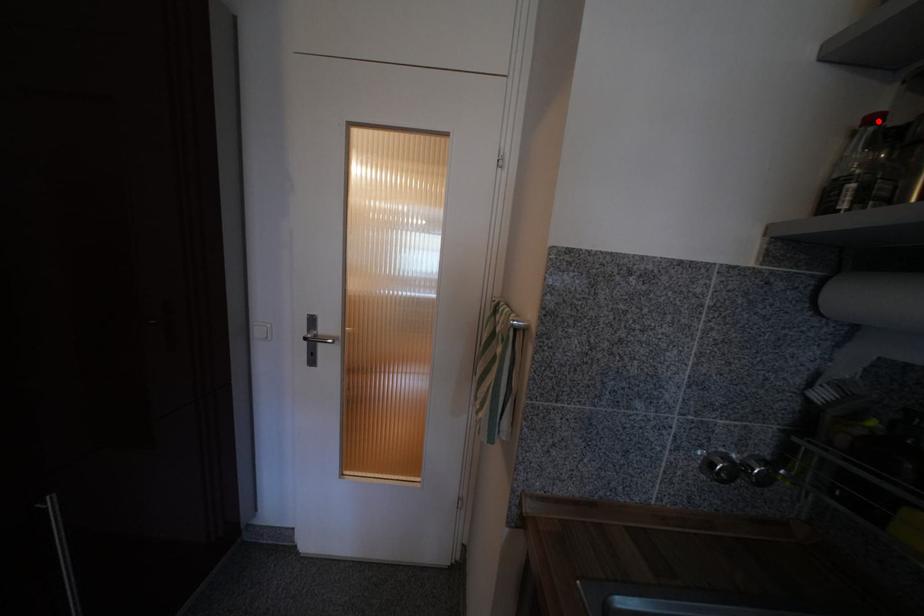
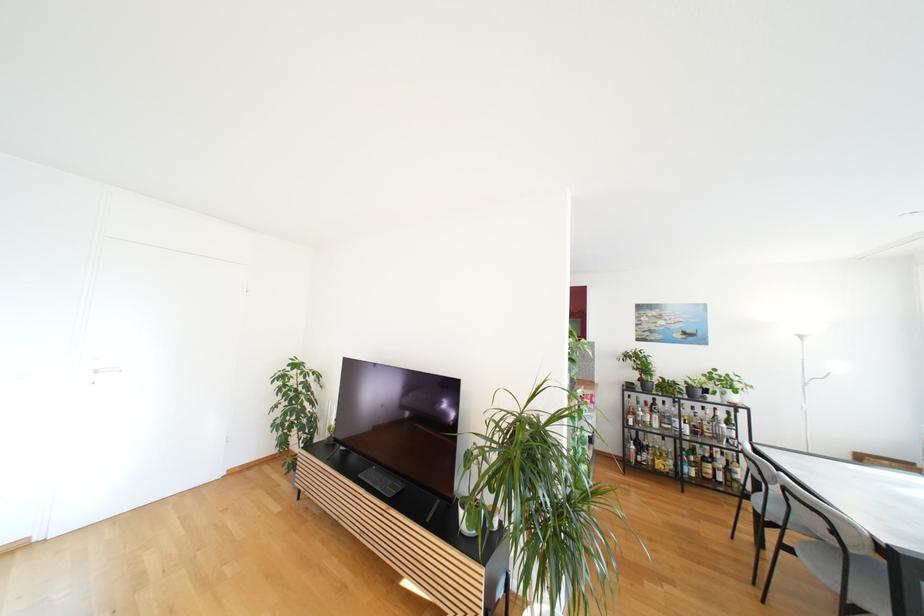
Question: I am providing you with two images of the same scene from different viewpoints. A red point is marked on the first image. At the location where the point appears in image 1, is it still visible in image 2?

Choices:
 (A) Yes
 (B) No

Answer: (B)